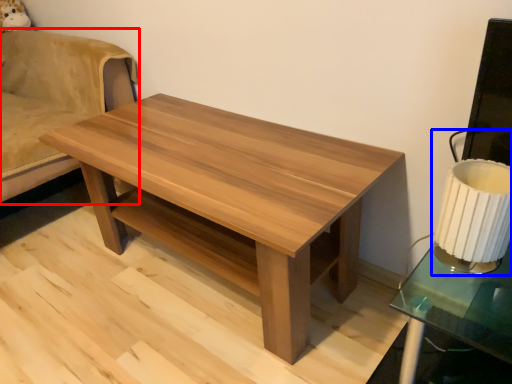
Question: Among these objects, which one is farthest to the camera, swivel chair (highlighted by a red box) or table lamp (highlighted by a blue box)?

Choices:
 (A) swivel chair
 (B) table lamp

Answer: (A)